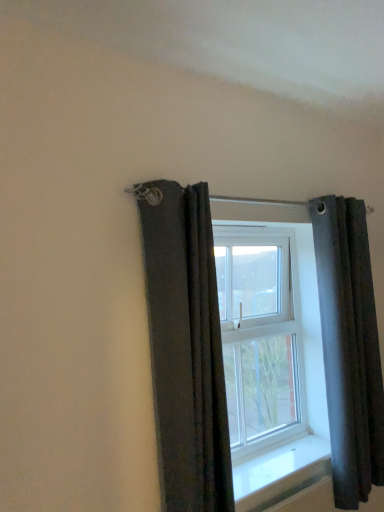
Question: From the image's perspective, is white glossy window sill at center below dark gray fabric curtain at upper left, arranged as the second curtain when viewed from the right?

Choices:
 (A) yes
 (B) no

Answer: (A)

Question: Is dark gray fabric curtain at upper left, the 1th curtain when ordered from left to right, at the back of white glossy window sill at center?

Choices:
 (A) no
 (B) yes

Answer: (A)

Question: Is white glossy window sill at center thinner than dark gray fabric curtain at upper left, the 1th curtain when ordered from left to right?

Choices:
 (A) no
 (B) yes

Answer: (A)

Question: Is white glossy window sill at center further to camera compared to dark gray fabric curtain at upper left, arranged as the second curtain when viewed from the right?

Choices:
 (A) yes
 (B) no

Answer: (A)

Question: Does white glossy window sill at center contain dark gray fabric curtain at upper left, acting as the first curtain starting from the front?

Choices:
 (A) no
 (B) yes

Answer: (A)

Question: In the image, is clear glass window at center on the left side or the right side of white glossy window sill at center?

Choices:
 (A) left
 (B) right

Answer: (A)

Question: Is point (307, 478) closer or farther from the camera than point (296, 455)?

Choices:
 (A) farther
 (B) closer

Answer: (B)

Question: In terms of height, does clear glass window at center look taller or shorter compared to white glossy window sill at center?

Choices:
 (A) tall
 (B) short

Answer: (A)

Question: From a real-world perspective, is clear glass window at center physically located above or below white glossy window sill at center?

Choices:
 (A) above
 (B) below

Answer: (A)

Question: Is point (279, 479) closer or farther from the camera than point (355, 495)?

Choices:
 (A) farther
 (B) closer

Answer: (B)

Question: Is white glossy window sill at center bigger or smaller than dark gray fabric curtain at right, which is the 2th curtain in left-to-right order?

Choices:
 (A) small
 (B) big

Answer: (A)

Question: From their relative heights in the image, would you say white glossy window sill at center is taller or shorter than dark gray fabric curtain at right, positioned as the second curtain in front-to-back order?

Choices:
 (A) tall
 (B) short

Answer: (B)

Question: Considering their positions, is white glossy window sill at center located in front of or behind dark gray fabric curtain at right, positioned as the second curtain in front-to-back order?

Choices:
 (A) front
 (B) behind

Answer: (A)

Question: Considering their positions, is dark gray fabric curtain at right, which is the 2th curtain in left-to-right order, located in front of or behind white glossy window sill at center?

Choices:
 (A) behind
 (B) front

Answer: (A)

Question: Is point (332, 302) positioned closer to the camera than point (321, 477)?

Choices:
 (A) closer
 (B) farther

Answer: (B)